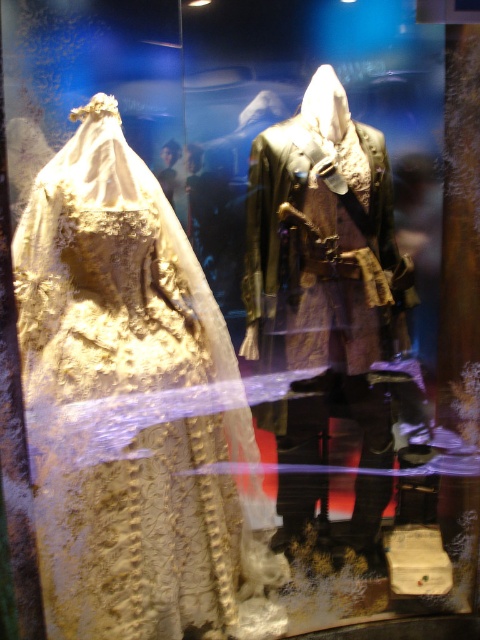
The image size is (480, 640). Identify the location of white lace dress at left. (133, 410).

Find the location of a particular element. Image resolution: width=480 pixels, height=640 pixels. white lace dress at left is located at coordinates (133, 410).